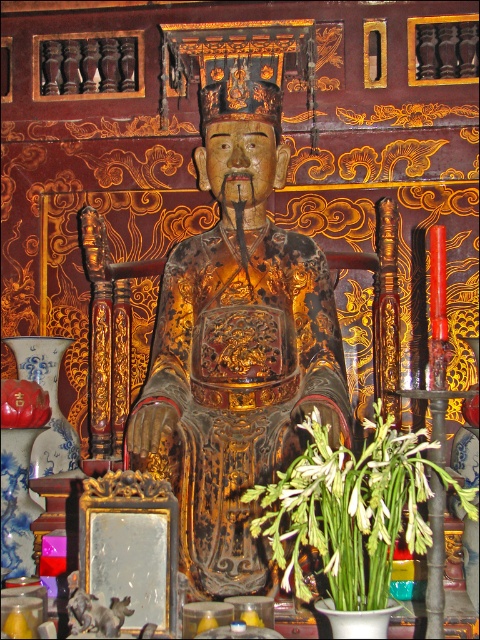
Question: Which object is closer to the camera taking this photo?

Choices:
 (A) green leafy plant at lower center
 (B) matte red vase at lower left
 (C) glossy wood statue at center

Answer: (A)

Question: Does glossy wood statue at center lie in front of green leafy plant at lower center?

Choices:
 (A) no
 (B) yes

Answer: (A)

Question: Which of these objects is positioned farthest from the matte red vase at lower left?

Choices:
 (A) glossy wood statue at center
 (B) green leafy plant at lower center

Answer: (B)

Question: Among these points, which one is farthest from the camera?

Choices:
 (A) (384, 572)
 (B) (10, 416)
 (C) (225, 227)

Answer: (C)

Question: From the image, what is the correct spatial relationship of glossy wood statue at center in relation to green leafy plant at lower center?

Choices:
 (A) below
 (B) above

Answer: (B)

Question: From the image, what is the correct spatial relationship of glossy wood statue at center in relation to matte red vase at lower left?

Choices:
 (A) below
 (B) above

Answer: (B)